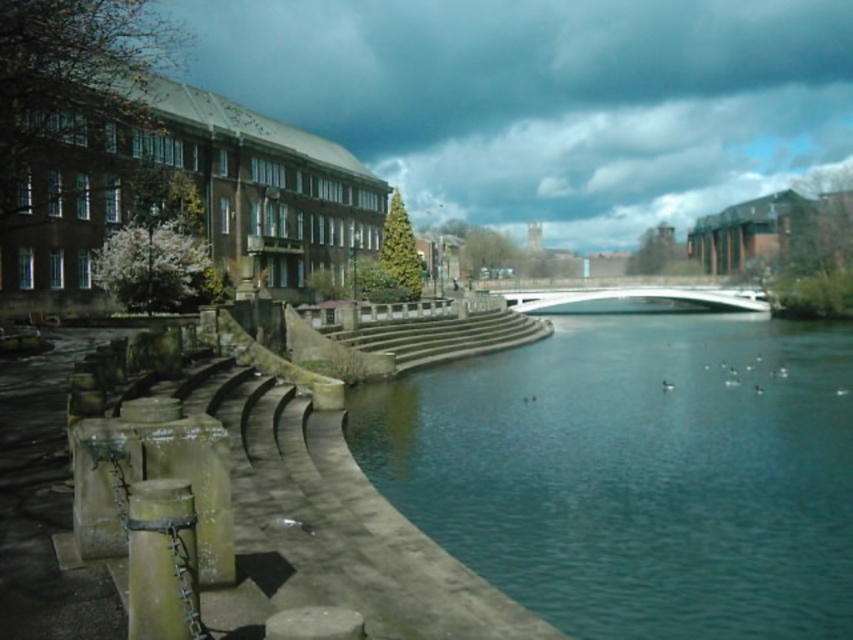
Does green weathered wood post at lower left have a greater height compared to white smooth bridge at center?

No, green weathered wood post at lower left is not taller than white smooth bridge at center.

How distant is green weathered wood post at lower left from white smooth bridge at center?

The distance of green weathered wood post at lower left from white smooth bridge at center is 108.52 meters.

In order to click on green weathered wood post at lower left in this screenshot , I will do `click(161, 561)`.

This screenshot has height=640, width=853. I want to click on green weathered wood post at lower left, so click(161, 561).

Does teal concrete river at center appear under white smooth bridge at center?

Indeed, teal concrete river at center is positioned under white smooth bridge at center.

Is point (688, 360) in front of point (612, 305)?

Yes, it is.

Locate an element on the screen. This screenshot has height=640, width=853. teal concrete river at center is located at coordinates pyautogui.click(x=636, y=472).

Between teal concrete river at center and green weathered wood post at lower left, which one has less height?

green weathered wood post at lower left

Between point (728, 346) and point (163, 561), which one is positioned behind?

The point (728, 346) is more distant.

Where is `teal concrete river at center`? teal concrete river at center is located at coordinates (636, 472).

Identify the location of teal concrete river at center. This screenshot has height=640, width=853. click(636, 472).